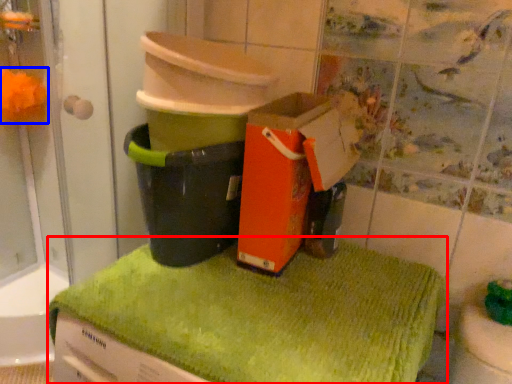
Question: Which object is closer to the camera taking this photo, bath towel (highlighted by a red box) or flower (highlighted by a blue box)?

Choices:
 (A) bath towel
 (B) flower

Answer: (A)